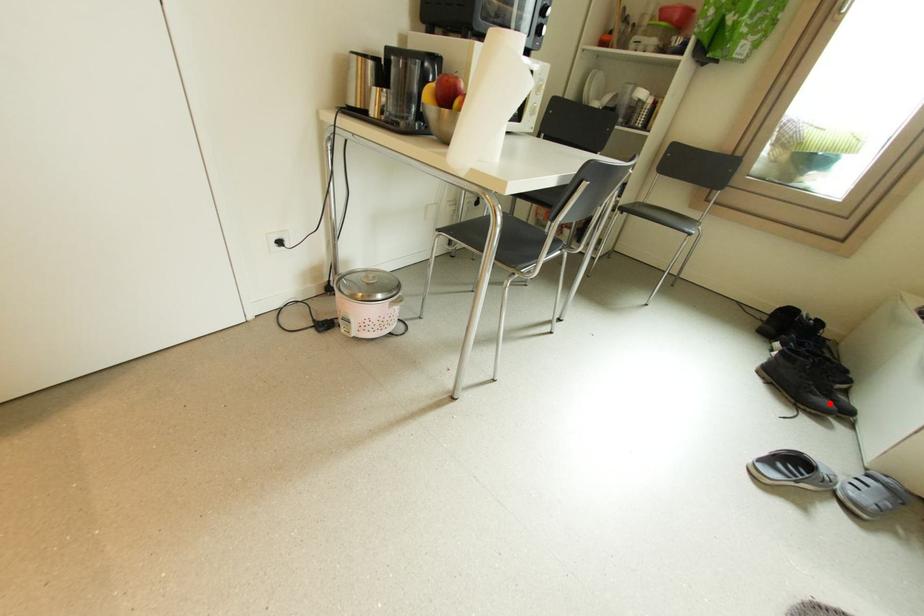
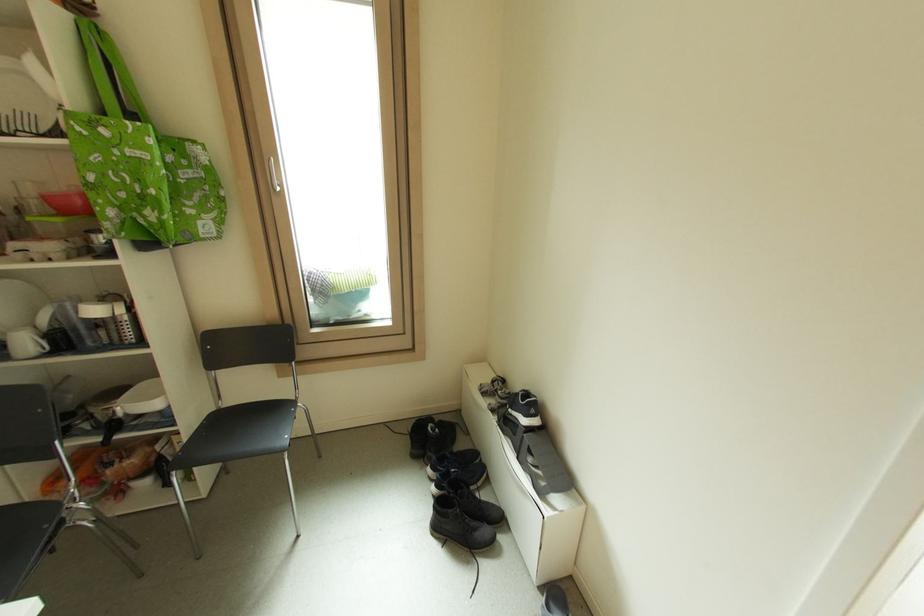
The point at the highlighted location is marked in the first image. Where is the corresponding point in the second image?

(490, 532)